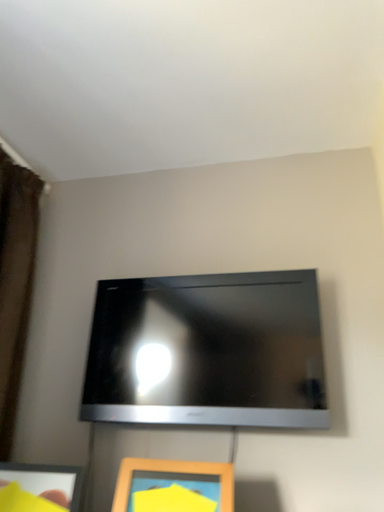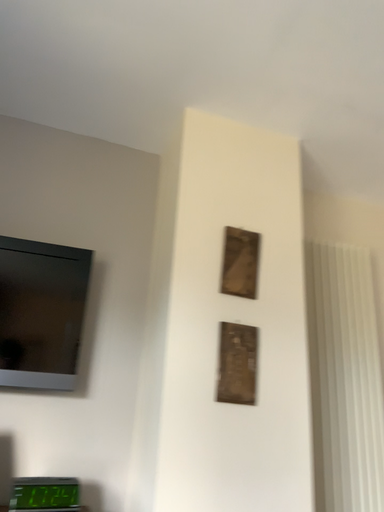
Question: Which way did the camera rotate in the video?

Choices:
 (A) rotated upward
 (B) rotated downward

Answer: (B)